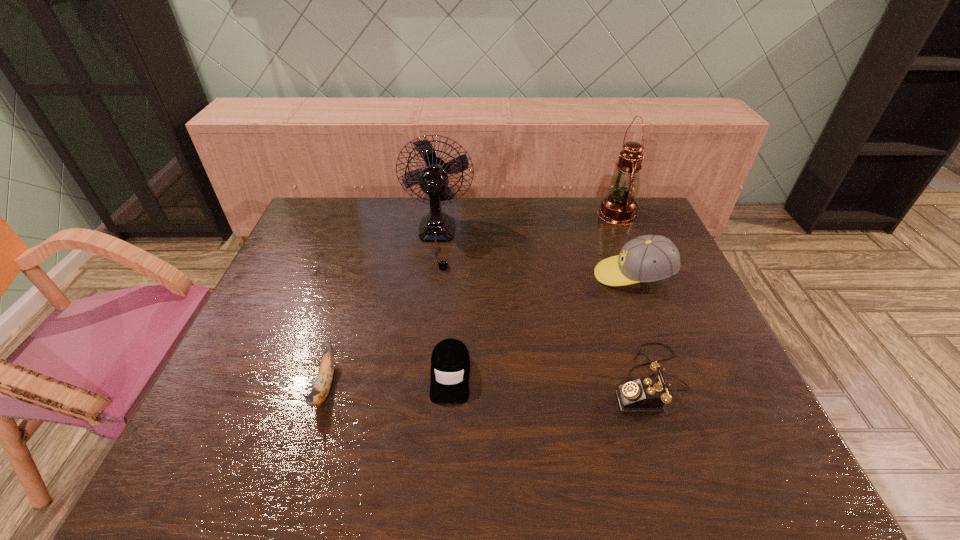
The width and height of the screenshot is (960, 540). Find the location of `oil lamp`. oil lamp is located at coordinates (619, 207).

What are the coordinates of `fan` in the screenshot? It's located at (437, 226).

Find the location of `baseball cap`. baseball cap is located at coordinates (649, 258).

Identify the location of telephone. (647, 395).

Locate an element on the screen. This screenshot has width=960, height=540. banana is located at coordinates (322, 385).

At what (x,y) coordinates should I click in order to perform the action: click on the shortest object. Please return your answer as a coordinate pair (x, y). The width and height of the screenshot is (960, 540). Looking at the image, I should click on (450, 364).

Find the location of a particular element. The width and height of the screenshot is (960, 540). vacant space located 0.260m on the left of the oil lamp is located at coordinates (523, 214).

Locate an element on the screen. This screenshot has height=540, width=960. vacant region located in front of the fan, indicating the direction of air flow is located at coordinates pyautogui.click(x=430, y=287).

Where is `vacant space positioned 0.390m on the front-facing side of the third tallest object`? The height and width of the screenshot is (540, 960). vacant space positioned 0.390m on the front-facing side of the third tallest object is located at coordinates (463, 275).

At what (x,y) coordinates should I click in order to perform the action: click on free point located 0.050m on the front-facing side of the third tallest object. Please return your answer as a coordinate pair (x, y). Looking at the image, I should click on (578, 275).